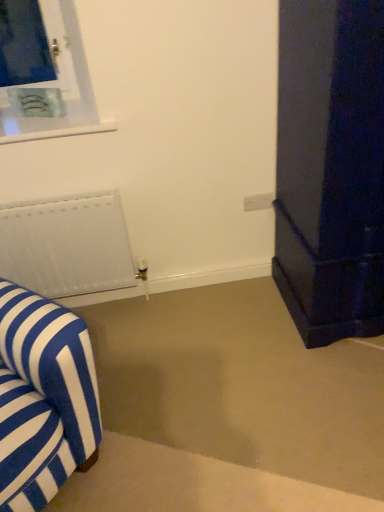
Question: Would you consider white matte radiator at left to be distant from blue and white striped fabric armchair at left?

Choices:
 (A) yes
 (B) no

Answer: (B)

Question: From the image's perspective, does white matte radiator at left appear lower than blue and white striped fabric armchair at left?

Choices:
 (A) no
 (B) yes

Answer: (A)

Question: Does white matte radiator at left have a smaller size compared to blue and white striped fabric armchair at left?

Choices:
 (A) no
 (B) yes

Answer: (B)

Question: Is white matte radiator at left positioned behind blue and white striped fabric armchair at left?

Choices:
 (A) no
 (B) yes

Answer: (B)

Question: Considering the relative sizes of white matte radiator at left and blue and white striped fabric armchair at left in the image provided, is white matte radiator at left shorter than blue and white striped fabric armchair at left?

Choices:
 (A) no
 (B) yes

Answer: (B)

Question: Is blue and white striped fabric armchair at left surrounded by white matte radiator at left?

Choices:
 (A) yes
 (B) no

Answer: (B)

Question: Is blue and white striped fabric armchair at left beside white matte radiator at left?

Choices:
 (A) no
 (B) yes

Answer: (A)

Question: From the image's perspective, is blue and white striped fabric armchair at left above white matte radiator at left?

Choices:
 (A) no
 (B) yes

Answer: (A)

Question: From the image's perspective, is blue and white striped fabric armchair at left below white matte radiator at left?

Choices:
 (A) no
 (B) yes

Answer: (B)

Question: Is blue and white striped fabric armchair at left positioned beyond the bounds of white matte radiator at left?

Choices:
 (A) yes
 (B) no

Answer: (A)

Question: Is blue and white striped fabric armchair at left thinner than white matte radiator at left?

Choices:
 (A) no
 (B) yes

Answer: (A)

Question: Can you confirm if blue and white striped fabric armchair at left is positioned to the left of white matte radiator at left?

Choices:
 (A) no
 (B) yes

Answer: (B)

Question: From a real-world perspective, is blue and white striped fabric armchair at left physically above white plastic electric outlet at center?

Choices:
 (A) no
 (B) yes

Answer: (A)